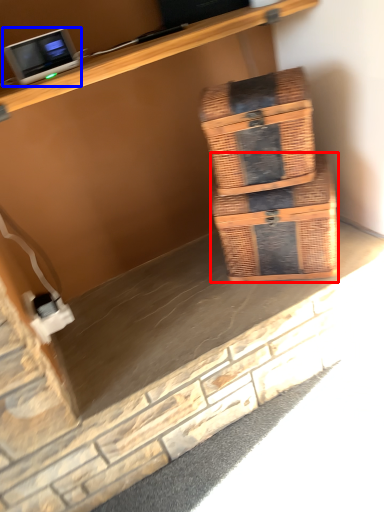
Question: Among these objects, which one is farthest to the camera, box (highlighted by a red box) or desktop computer (highlighted by a blue box)?

Choices:
 (A) box
 (B) desktop computer

Answer: (A)